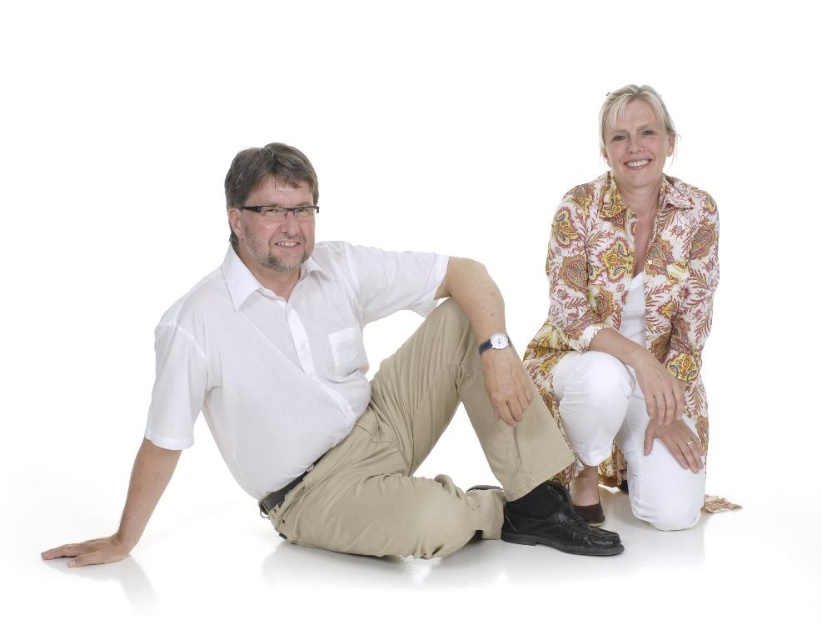
You are a fashion designer analyzing the image. You need to determine which item of clothing is taller between the white cotton shirt at left and the khaki pants at center. Which one is taller?

The white cotton shirt at left is taller than the khaki pants at center.

Consider the image. You are a fashion designer observing two shirts on a plain white background. You need to decide which one is more suitable for a formal event. Which shirt between the white cotton shirt at left and the white smooth shirt at left should you choose based on their height?

The white cotton shirt at left is much taller than the white smooth shirt at left, so it would be more suitable for a formal event due to its taller design.

You are a photographer setting up a shoot with two people. You notice two points marked in the scene. The first point is at coordinates point (x=499, y=323) and the second is at point (x=229, y=355). Which of these two points is closer to the camera?

The point at coordinates point (x=499, y=323) is closer to the camera because it is further to the viewer than point (x=229, y=355).